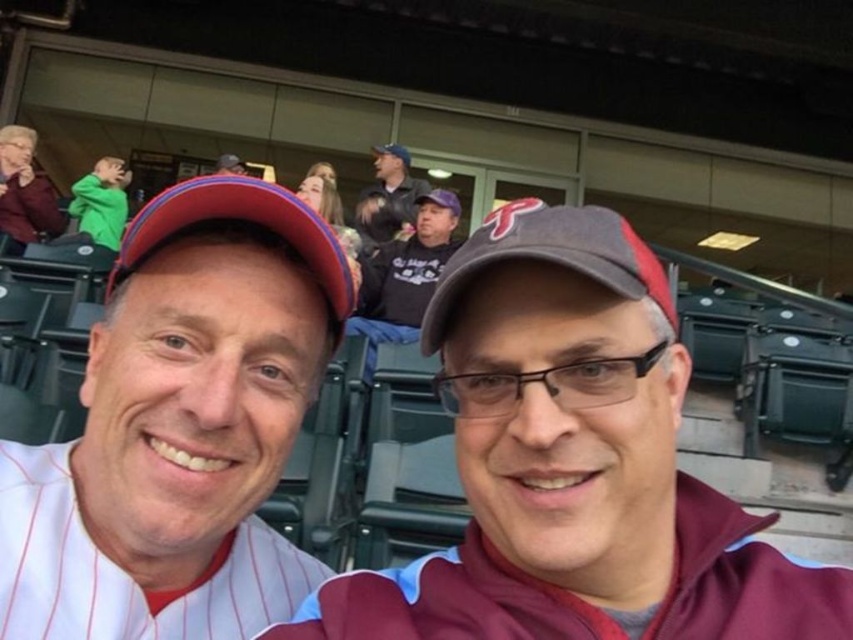
Question: Does maroon fabric jacket at center appear on the left side of white pinstriped jersey at upper left?

Choices:
 (A) yes
 (B) no

Answer: (B)

Question: Which point is farther to the camera?

Choices:
 (A) maroon fabric jacket at center
 (B) white pinstriped jersey at upper left
 (C) dark blue baseball cap at upper center
 (D) dark gray hoodie at center

Answer: (C)

Question: Can you confirm if white pinstriped jersey at upper left is thinner than dark gray hoodie at center?

Choices:
 (A) yes
 (B) no

Answer: (A)

Question: Among these objects, which one is nearest to the camera?

Choices:
 (A) maroon fabric jacket at center
 (B) white pinstriped jersey at upper left

Answer: (A)

Question: Is white pinstriped jersey at upper left to the right of dark gray hoodie at center from the viewer's perspective?

Choices:
 (A) no
 (B) yes

Answer: (A)

Question: Which point is farther to the camera?

Choices:
 (A) dark blue baseball cap at upper center
 (B) dark gray hoodie at center

Answer: (A)